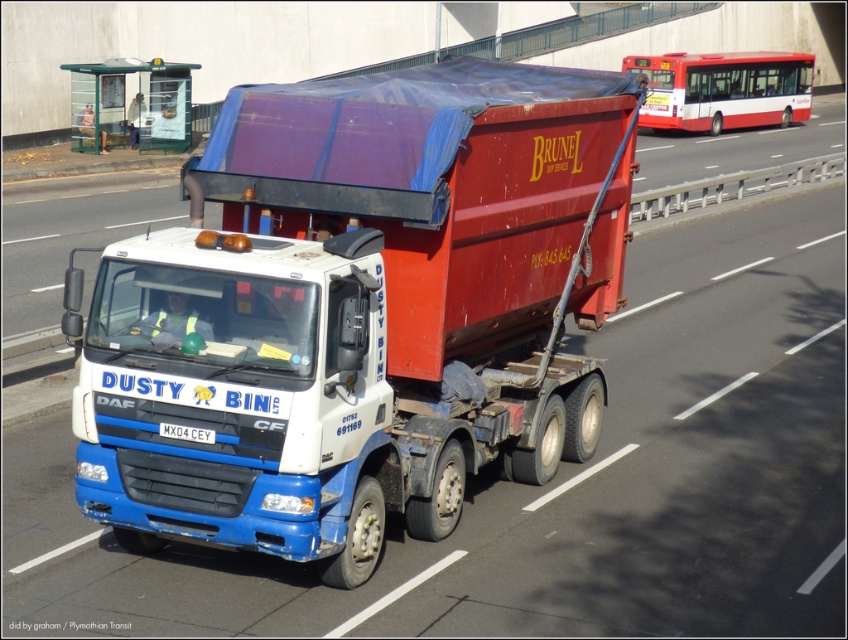
Measure the distance between matte white truck at center and white plastic license plate at center.

matte white truck at center and white plastic license plate at center are 2.17 meters apart from each other.

Can you confirm if matte white truck at center is positioned to the right of white plastic license plate at center?

Yes, matte white truck at center is to the right of white plastic license plate at center.

The width and height of the screenshot is (848, 640). Find the location of `matte white truck at center`. matte white truck at center is located at coordinates (360, 310).